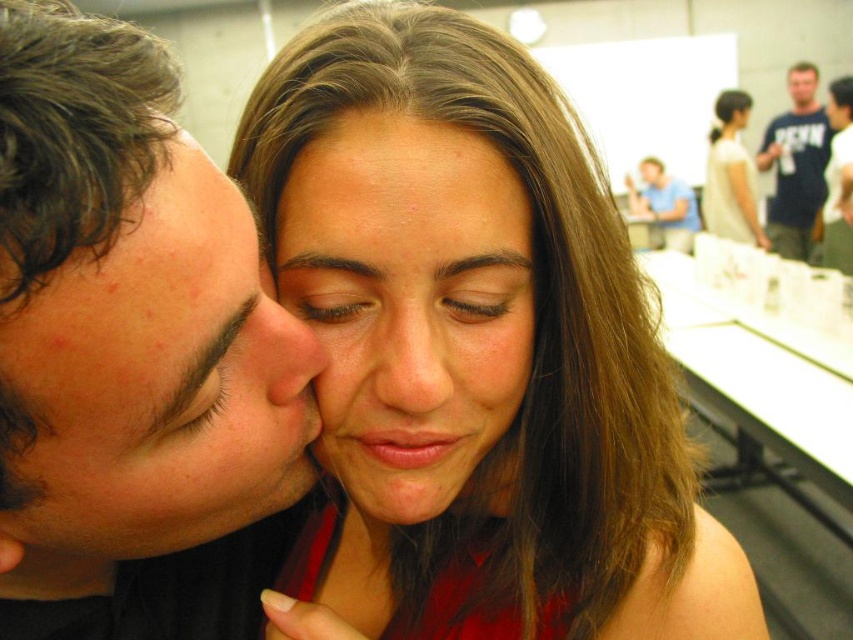
Does smooth skin nose at center have a greater height compared to light beige shirt at upper center?

In fact, smooth skin nose at center may be shorter than light beige shirt at upper center.

Is point (415, 420) closer to viewer compared to point (762, 228)?

Yes, point (415, 420) is closer to viewer.

Find the location of a particular element. The height and width of the screenshot is (640, 853). smooth skin nose at center is located at coordinates (416, 358).

Who is lower down, oily skin face at left or light beige shirt at upper center?

oily skin face at left is lower down.

Where is `oily skin face at left`? oily skin face at left is located at coordinates (157, 381).

Does blue cotton shirt at upper right have a lesser width compared to matte skin nose at center?

Incorrect, blue cotton shirt at upper right's width is not less than matte skin nose at center's.

From the picture: Is blue cotton shirt at upper right below matte skin nose at center?

Actually, blue cotton shirt at upper right is above matte skin nose at center.

This screenshot has width=853, height=640. I want to click on blue cotton shirt at upper right, so click(x=796, y=164).